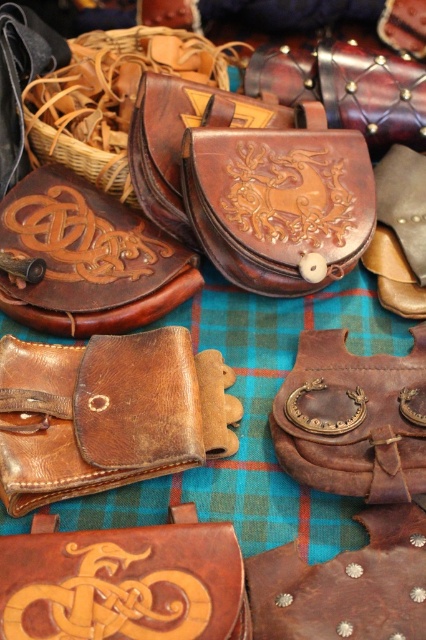
Question: Is brown leather pouch at upper left below brown leather pouch at center?

Choices:
 (A) yes
 (B) no

Answer: (B)

Question: Is brown leather pouch at upper left further to the viewer compared to brown leather pouch at center?

Choices:
 (A) yes
 (B) no

Answer: (A)

Question: Does brown leather pouch at upper left appear on the left side of brown leather pouch at center?

Choices:
 (A) no
 (B) yes

Answer: (B)

Question: Which of the following is the closest to the observer?

Choices:
 (A) (307, 330)
 (B) (129, 228)

Answer: (A)

Question: Which of the following is the closest to the observer?

Choices:
 (A) (397, 384)
 (B) (11, 305)

Answer: (A)

Question: Which point appears closest to the camera in this image?

Choices:
 (A) (385, 371)
 (B) (34, 307)

Answer: (A)